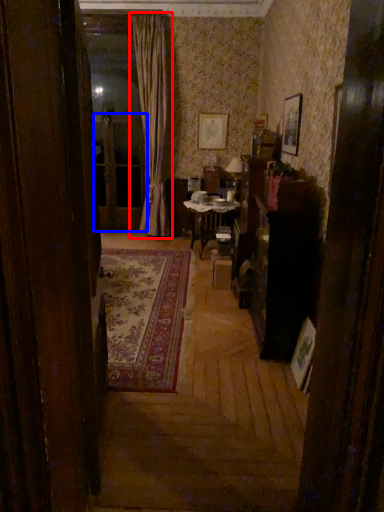
Question: Which point is further to the camera, curtain (highlighted by a red box) or screen door (highlighted by a blue box)?

Choices:
 (A) curtain
 (B) screen door

Answer: (B)